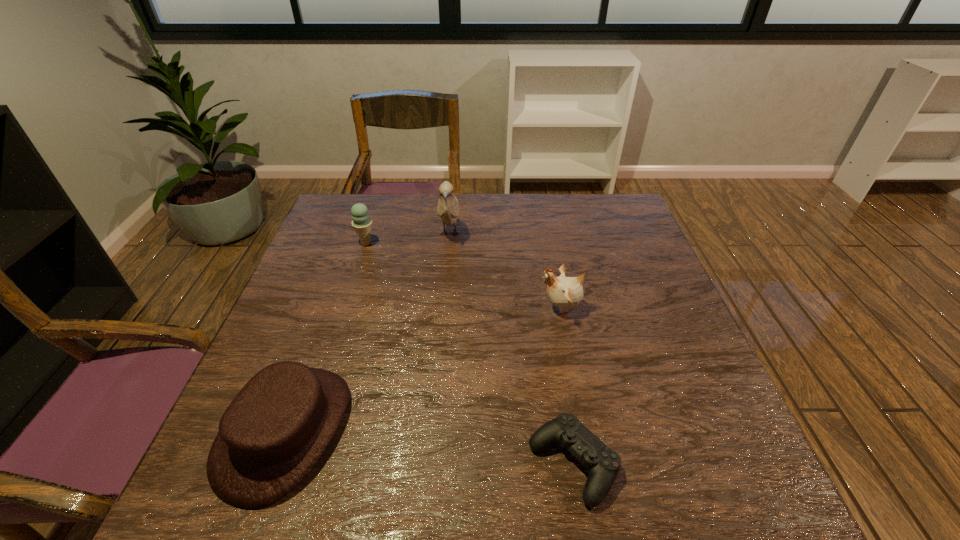
You are a GUI agent. You are given a task and a screenshot of the screen. Output one action in this format:
    pyautogui.click(x=<x>, y=<y>)
    Task: Click on the free spot between the taller bird and the hat
    This screenshot has height=540, width=960.
    Given the screenshot: What is the action you would take?
    pyautogui.click(x=368, y=333)

The height and width of the screenshot is (540, 960). What are the coordinates of `unoccupied position between the ice cream and the shorter bird` in the screenshot? It's located at (464, 276).

Find the location of `vacant space that is in between the shorter bird and the ice cream`. vacant space that is in between the shorter bird and the ice cream is located at coordinates (464, 276).

The height and width of the screenshot is (540, 960). I want to click on free space between the nearer bird and the ice cream, so click(464, 276).

The width and height of the screenshot is (960, 540). In order to click on vacant area between the right bird and the left bird in this screenshot , I will do `click(505, 271)`.

Find the location of `empty space that is in between the third farthest object and the ice cream`. empty space that is in between the third farthest object and the ice cream is located at coordinates [x=464, y=276].

Where is `object that is the third closest to the left bird`? object that is the third closest to the left bird is located at coordinates (273, 433).

Identify which object is located as the nearest to the second shortest object. Please provide its 2D coordinates. Your answer should be formatted as a tuple, i.e. [(x, y)], where the tuple contains the x and y coordinates of a point satisfying the conditions above.

[(603, 464)]

At what (x,y) coordinates should I click in order to perform the action: click on free location that satisfies the following two spatial constraints: 1. on the front side of the ice cream; 2. on the left side of the control. Please return your answer as a coordinate pair (x, y). Image resolution: width=960 pixels, height=540 pixels. Looking at the image, I should click on (295, 464).

At what (x,y) coordinates should I click in order to perform the action: click on free spot that satisfies the following two spatial constraints: 1. on the back side of the hat; 2. on the right side of the ice cream. Please return your answer as a coordinate pair (x, y). Looking at the image, I should click on (353, 243).